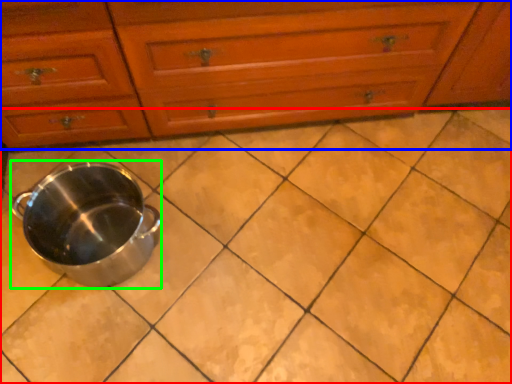
Question: Which object is positioned farthest from ceramic tile (highlighted by a red box)? Select from chest of drawers (highlighted by a blue box) and crock pot (highlighted by a green box).

Choices:
 (A) chest of drawers
 (B) crock pot

Answer: (A)